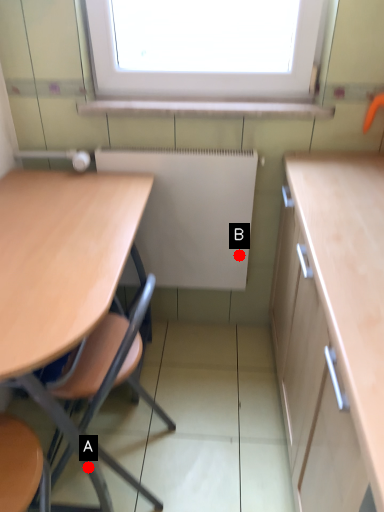
Question: Two points are circled on the image, labeled by A and B beside each circle. Which of the following is the closest to the observer?

Choices:
 (A) A is closer
 (B) B is closer

Answer: (A)